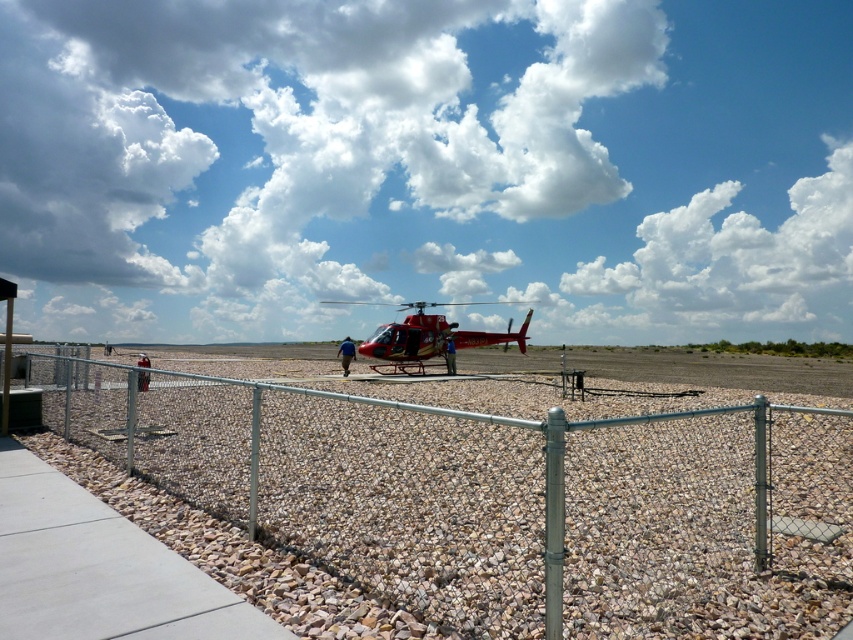
Question: Does silver chain-link fence at center lie in front of red glossy helicopter at center?

Choices:
 (A) no
 (B) yes

Answer: (B)

Question: Among these points, which one is nearest to the camera?

Choices:
 (A) (405, 340)
 (B) (724, 524)

Answer: (B)

Question: Can you confirm if silver chain-link fence at center is positioned above red glossy helicopter at center?

Choices:
 (A) no
 (B) yes

Answer: (A)

Question: Is silver chain-link fence at center further to camera compared to red glossy helicopter at center?

Choices:
 (A) no
 (B) yes

Answer: (A)